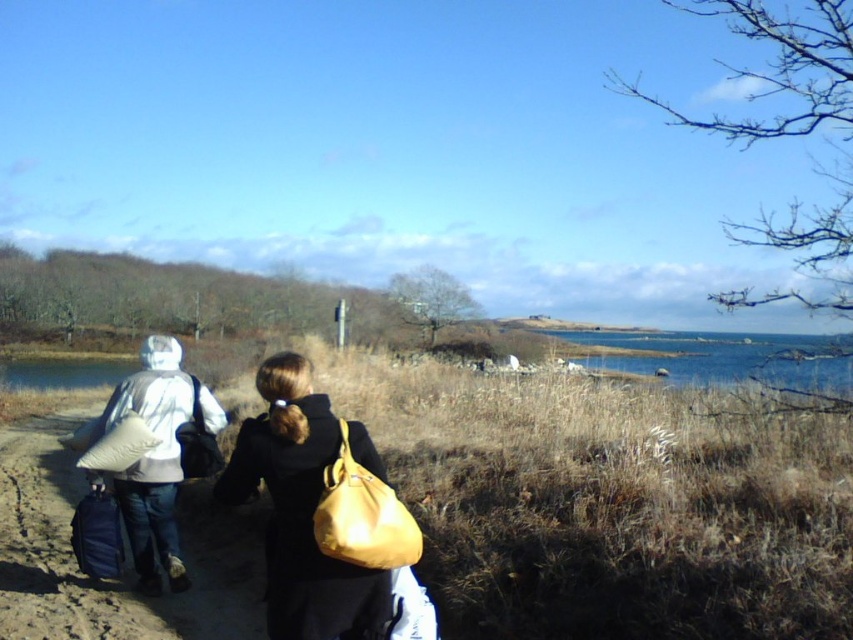
Question: Is yellow matte backpack at center wider than matte yellow bag at center?

Choices:
 (A) yes
 (B) no

Answer: (A)

Question: Can you confirm if matte white pillow at left is smaller than matte black bag at left?

Choices:
 (A) no
 (B) yes

Answer: (A)

Question: Which point is farther to the camera?

Choices:
 (A) matte white pillow at left
 (B) matte black bag at left
 (C) matte black backpack at lower left
 (D) blue water at right

Answer: (D)

Question: Which point is closer to the camera?

Choices:
 (A) yellow matte backpack at center
 (B) blue water at right
 (C) matte black backpack at lower left

Answer: (A)

Question: Where is blue water at right located in relation to matte black bag at left in the image?

Choices:
 (A) left
 (B) right

Answer: (B)

Question: Which point is farther to the camera?

Choices:
 (A) matte black bag at left
 (B) matte yellow bag at center
 (C) matte black backpack at lower left

Answer: (C)